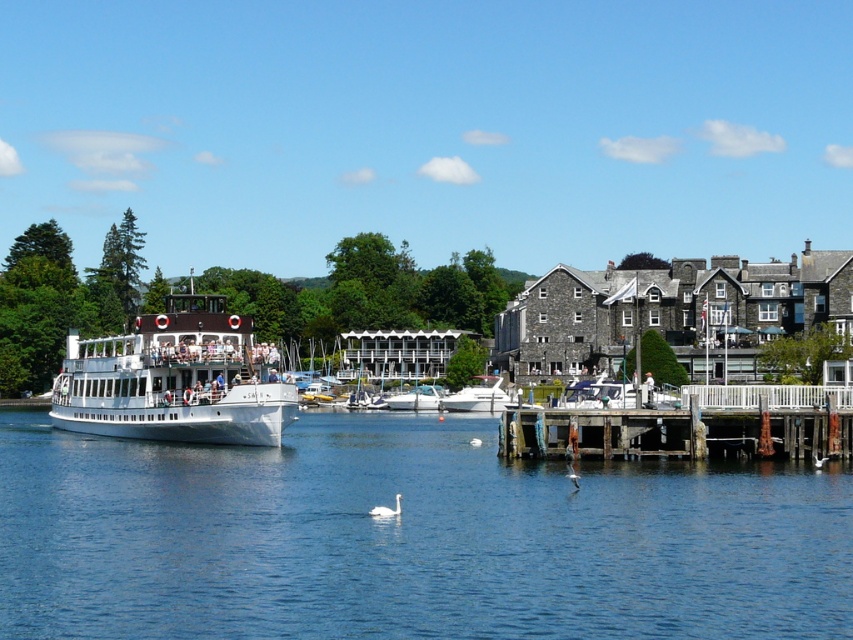
How far apart are wooden dock at lower right and white glossy swan at lower center?

They are 20.69 meters apart.

Is wooden dock at lower right closer to the viewer compared to white glossy swan at lower center?

No, it is behind white glossy swan at lower center.

This screenshot has height=640, width=853. What do you see at coordinates (691, 426) in the screenshot? I see `wooden dock at lower right` at bounding box center [691, 426].

Image resolution: width=853 pixels, height=640 pixels. What are the coordinates of `wooden dock at lower right` in the screenshot? It's located at (691, 426).

Is white glossy ferry at left smaller than white glossy motorboat at center?

Incorrect, white glossy ferry at left is not smaller in size than white glossy motorboat at center.

What do you see at coordinates (175, 380) in the screenshot? I see `white glossy ferry at left` at bounding box center [175, 380].

This screenshot has width=853, height=640. I want to click on white glossy ferry at left, so click(x=175, y=380).

Consider the image. Who is higher up, clear blue water at center or white glossy swan at lower center?

white glossy swan at lower center is higher up.

The height and width of the screenshot is (640, 853). What are the coordinates of `clear blue water at center` in the screenshot? It's located at (407, 538).